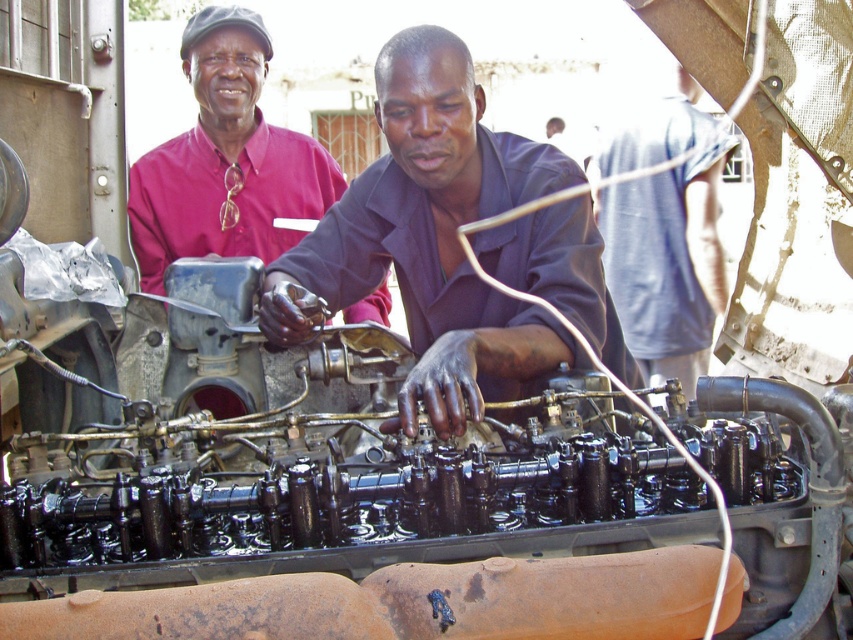
You are standing in the workshop and need to pass through the space between the matte black shirt at center and the matte pink shirt at upper left. The width of your equipment is 1 meter. Can you fit through the space between them?

The matte black shirt at center is wider than the matte pink shirt at upper left, so the space between them might be too narrow for your 1 meter wide equipment. It is recommended to check the exact width before proceeding.

You are a photographer trying to capture both the matte black shirt at center and the gray fabric shirt at center in a single frame. Which person should you position closer to the camera to ensure both are fully visible?

The matte black shirt at center has a lesser height compared to the gray fabric shirt at center. To ensure both are fully visible in the frame, position the matte black shirt at center closer to the camera since it is shorter and needs to be magnified to match the apparent size of the taller gray fabric shirt at center.

You are standing in front of the engine and want to reach both the point at coordinates point (467,292) and the point at coordinates point (602,204). Which point should you reach first to touch the closer one?

Point (467,292) is closer to the camera than point (602,204), so you should reach for point (467,292) first to touch the closer one.